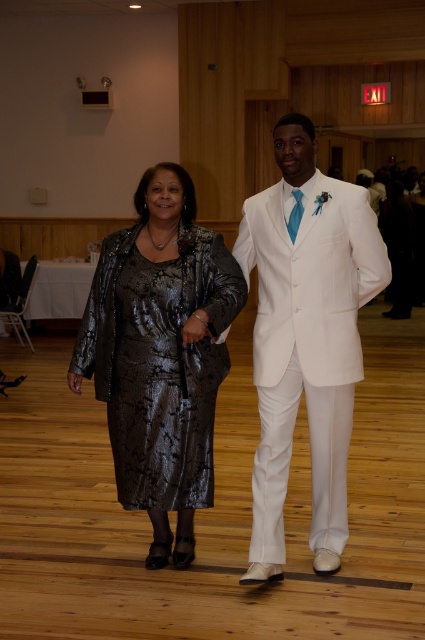
Find the location of a particular element. The image size is (425, 640). shiny metallic dress at center is located at coordinates (161, 355).

Which is in front, point (187, 371) or point (354, 289)?

Positioned in front is point (354, 289).

This screenshot has width=425, height=640. Identify the location of shiny metallic dress at center. (161, 355).

Find the location of a particular element. The width and height of the screenshot is (425, 640). shiny metallic dress at center is located at coordinates (161, 355).